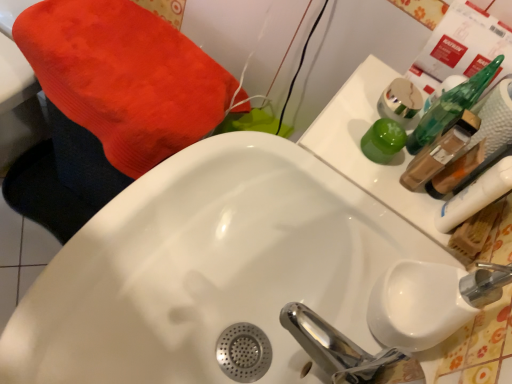
The image size is (512, 384). I want to click on vacant space behind green glossy cup at upper right, arranged as the second mouthwash when viewed from the top, so click(381, 97).